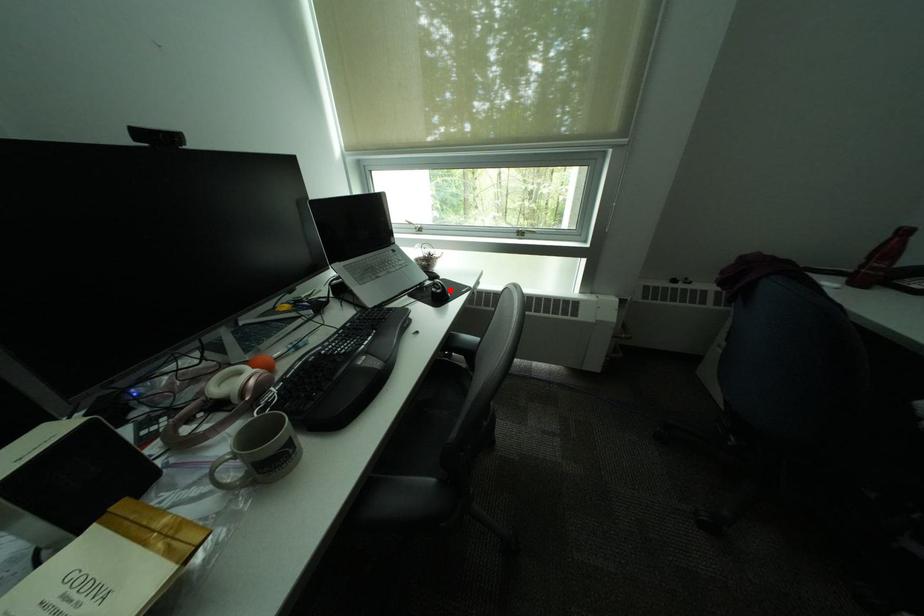
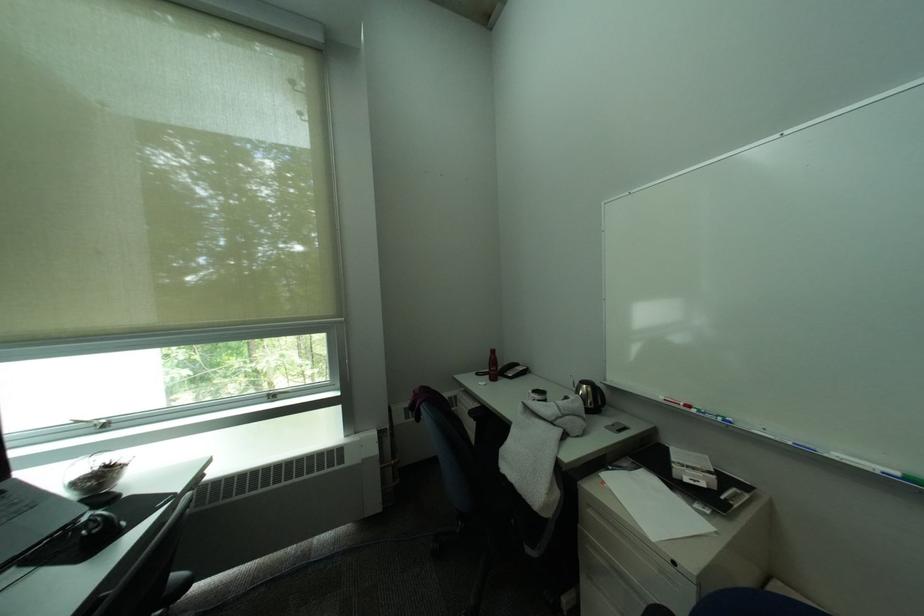
Question: I am providing you with two images of the same scene from different viewpoints. A red point is marked on the first image. At the location where the point appears in image 1, is it still visible in image 2?

Choices:
 (A) Yes
 (B) No

Answer: (A)